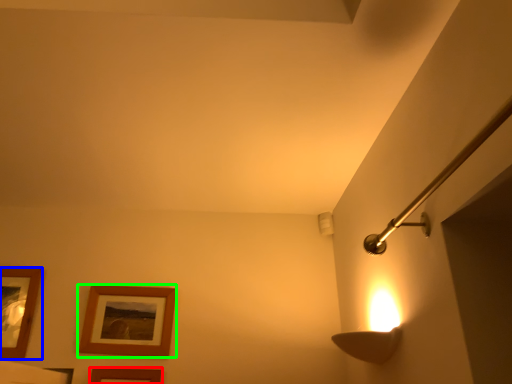
Question: Based on their relative distances, which object is nearer to picture frame (highlighted by a red box)? Choose from picture frame (highlighted by a blue box) and picture frame (highlighted by a green box).

Choices:
 (A) picture frame
 (B) picture frame

Answer: (B)